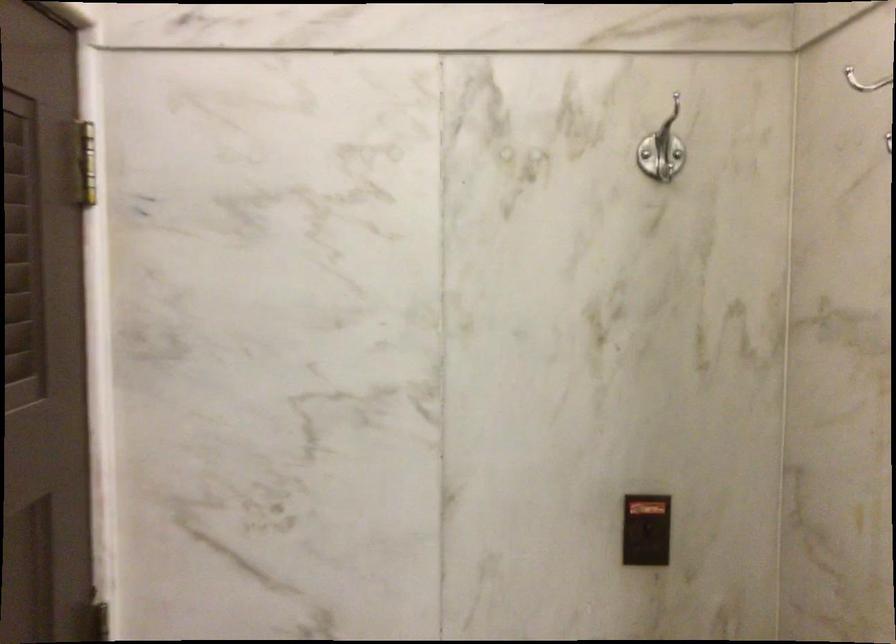
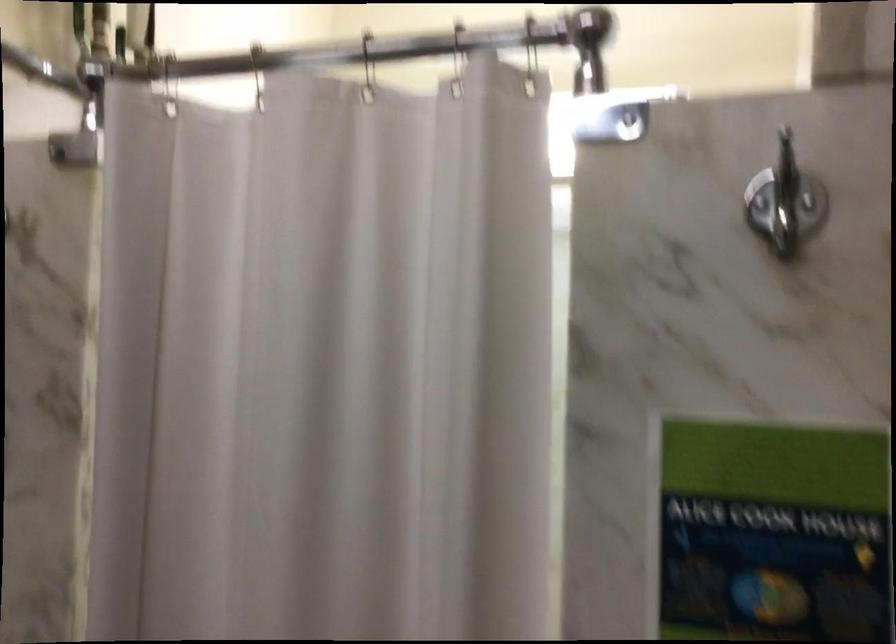
Question: The camera is either moving clockwise (left) or counter-clockwise (right) around the object. The first image is from the beginning of the video and the second image is from the end. Is the camera moving left or right when shooting the video?

Choices:
 (A) Left
 (B) Right

Answer: (B)